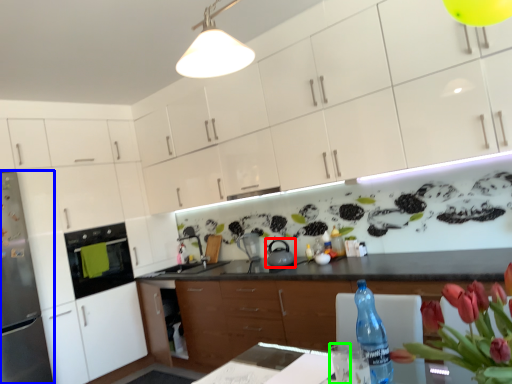
Question: Based on their relative distances, which object is farther from tea pot (highlighted by a red box)? Choose from refrigerator (highlighted by a blue box) and water (highlighted by a green box).

Choices:
 (A) refrigerator
 (B) water

Answer: (A)